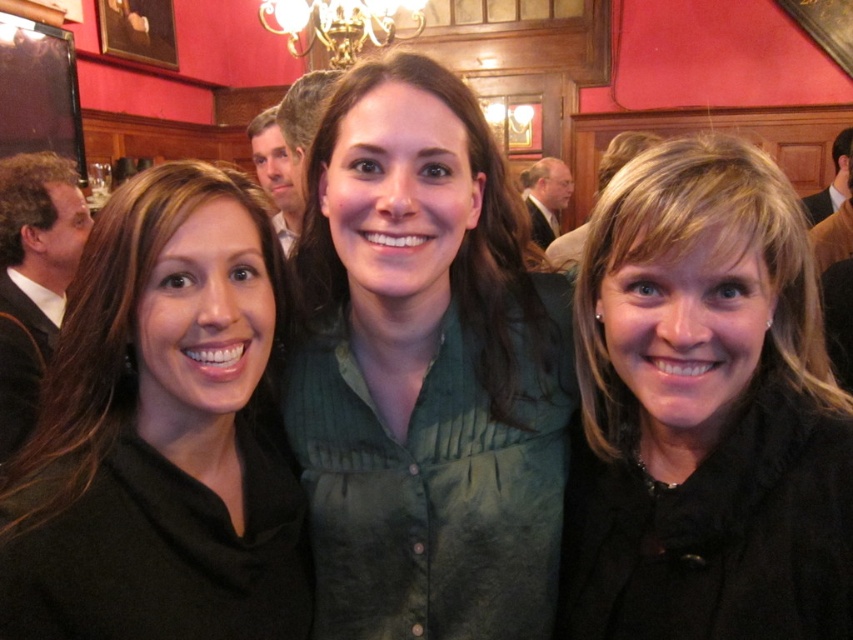
In the scene shown: Does green fabric shirt at center appear over gold metallic chandelier at upper center?

No, green fabric shirt at center is not above gold metallic chandelier at upper center.

Image resolution: width=853 pixels, height=640 pixels. Describe the element at coordinates (425, 371) in the screenshot. I see `green fabric shirt at center` at that location.

The height and width of the screenshot is (640, 853). I want to click on green fabric shirt at center, so click(x=425, y=371).

Describe the element at coordinates (704, 412) in the screenshot. I see `black matte jacket at right` at that location.

Does black matte jacket at right have a larger size compared to black matte shirt at center?

Incorrect, black matte jacket at right is not larger than black matte shirt at center.

Find the location of a particular element. This screenshot has height=640, width=853. black matte jacket at right is located at coordinates (704, 412).

Where is `black matte jacket at right`? This screenshot has width=853, height=640. black matte jacket at right is located at coordinates (704, 412).

Does green fabric shirt at center appear over black matte jacket at right?

Correct, green fabric shirt at center is located above black matte jacket at right.

Is green fabric shirt at center positioned before black matte jacket at right?

No, it is behind black matte jacket at right.

Where is `green fabric shirt at center`? The height and width of the screenshot is (640, 853). green fabric shirt at center is located at coordinates (425, 371).